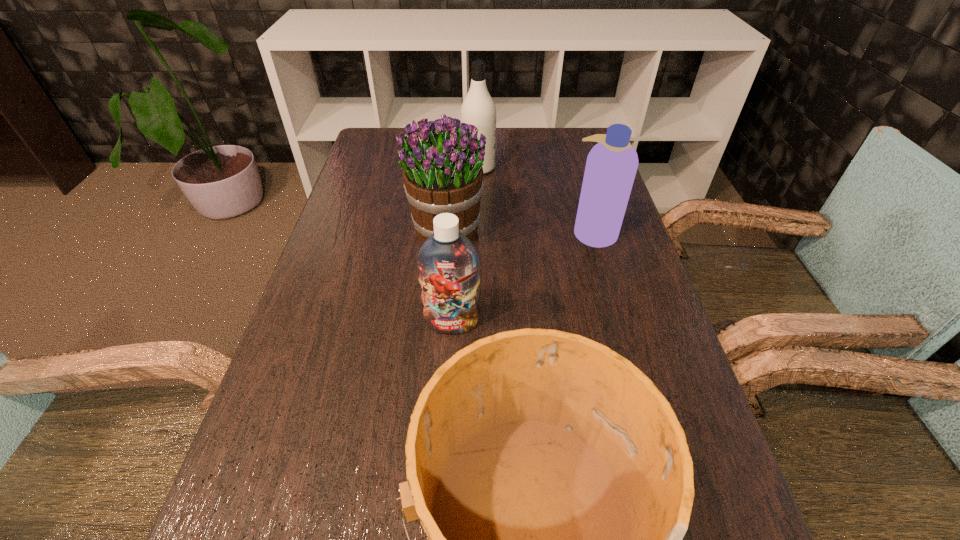
At what (x,y) coordinates should I click in order to perform the action: click on free region at the far edge of the desktop. Please return your answer as a coordinate pair (x, y). Looking at the image, I should click on (538, 138).

Identify the location of blank space at the left edge. This screenshot has height=540, width=960. (317, 502).

I want to click on vacant space at the right edge of the desktop, so click(564, 167).

Find the location of a particular element. free space at the far left corner is located at coordinates (380, 153).

The width and height of the screenshot is (960, 540). In order to click on unoccupied area between the second farthest shampoo and the farthest shampoo in this screenshot , I will do `click(536, 200)`.

You are a GUI agent. You are given a task and a screenshot of the screen. Output one action in this format:
    pyautogui.click(x=<x>, y=<y>)
    Task: Click on the free space between the bouquet and the rightmost shampoo
    
    Given the screenshot: What is the action you would take?
    pyautogui.click(x=520, y=231)

The width and height of the screenshot is (960, 540). In order to click on vacant space that is in between the bouquet and the second nearest shampoo in this screenshot , I will do `click(520, 231)`.

At what (x,y) coordinates should I click in order to perform the action: click on free space between the farthest object and the second nearest shampoo. Please return your answer as a coordinate pair (x, y). This screenshot has height=540, width=960. Looking at the image, I should click on (536, 200).

This screenshot has width=960, height=540. I want to click on the closest object to the second nearest object, so click(555, 484).

Identify which object is the second nearest to the second farthest shampoo. Please provide its 2D coordinates. Your answer should be formatted as a tuple, i.e. [(x, y)], where the tuple contains the x and y coordinates of a point satisfying the conditions above.

[(478, 108)]